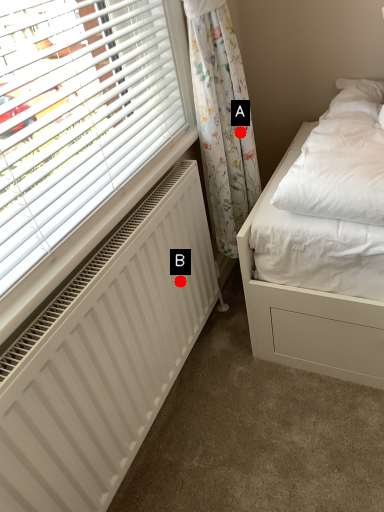
Question: Two points are circled on the image, labeled by A and B beside each circle. Which point appears farthest from the camera in this image?

Choices:
 (A) A is further
 (B) B is further

Answer: (A)